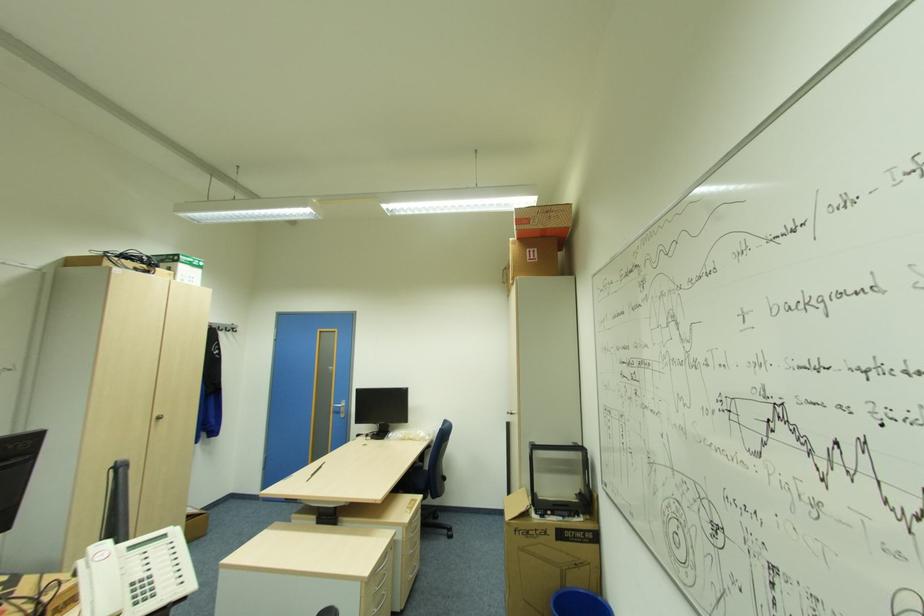
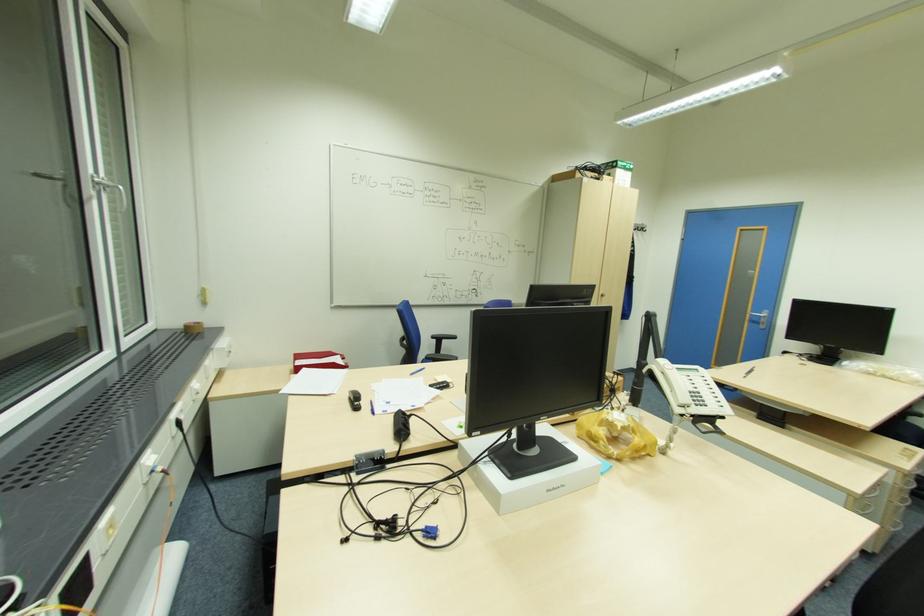
Question: I am providing you with two images of the same scene from different viewpoints. Please identify which objects are invisible in image2.

Choices:
 (A) white telephone handset
 (B) roll of brown tape
 (C) silver drawer handle
 (D) none of these

Answer: (D)